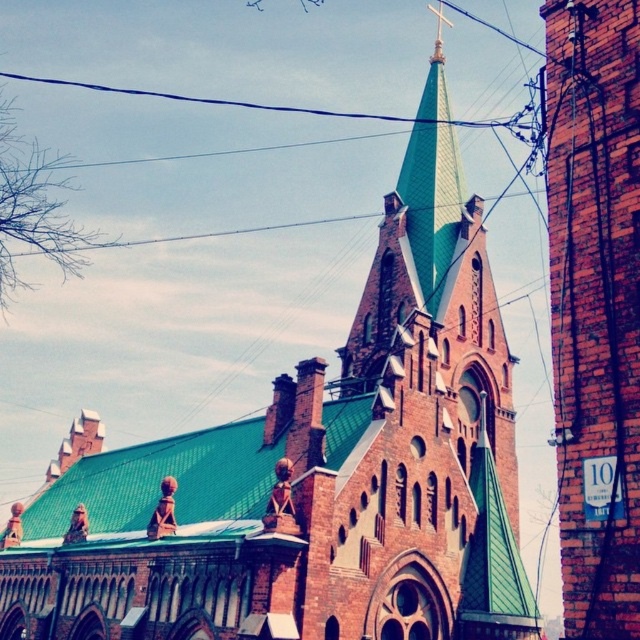
Question: Which point is closer to the camera?

Choices:
 (A) green tiled spire at center
 (B) black wire at upper center

Answer: (A)

Question: In this image, where is green tiled spire at center located relative to black wire at upper center?

Choices:
 (A) right
 (B) left

Answer: (A)

Question: Is green tiled spire at center positioned in front of black wire at upper center?

Choices:
 (A) yes
 (B) no

Answer: (A)

Question: Among these objects, which one is farthest from the camera?

Choices:
 (A) black wire at upper center
 (B) green tiled spire at center

Answer: (A)

Question: In this image, where is green tiled spire at center located relative to black wire at upper center?

Choices:
 (A) below
 (B) above

Answer: (A)